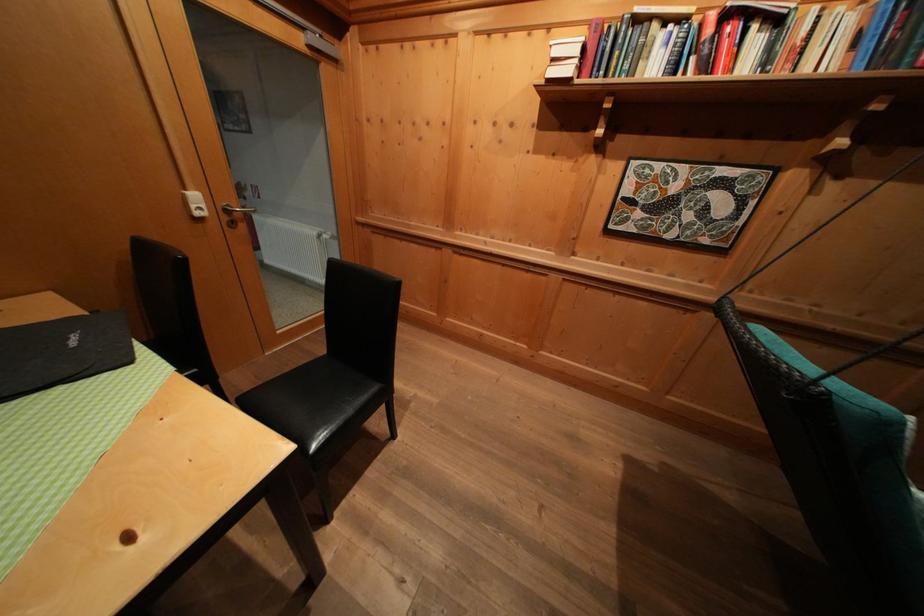
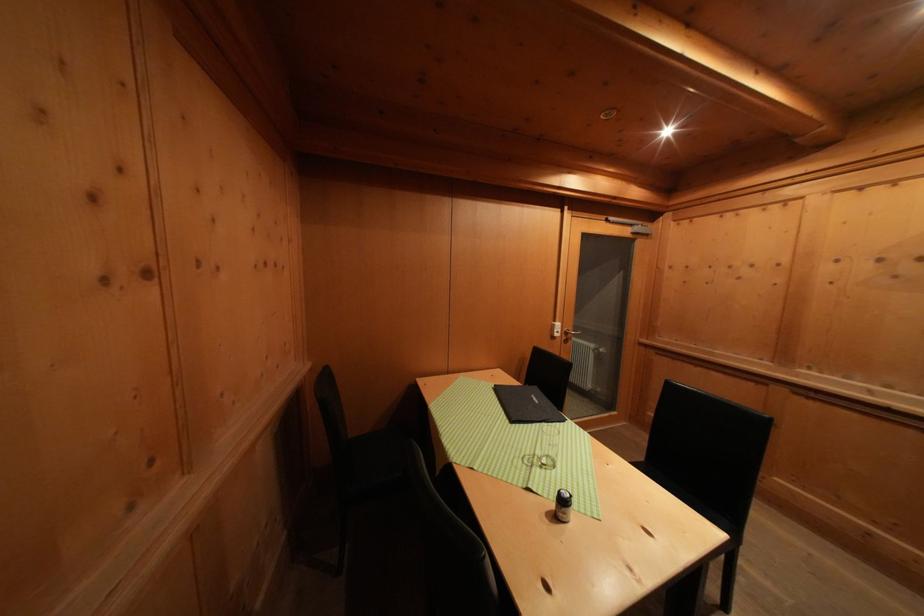
The point at (42, 400) is marked in the first image. Where is the corresponding point in the second image?

(543, 429)